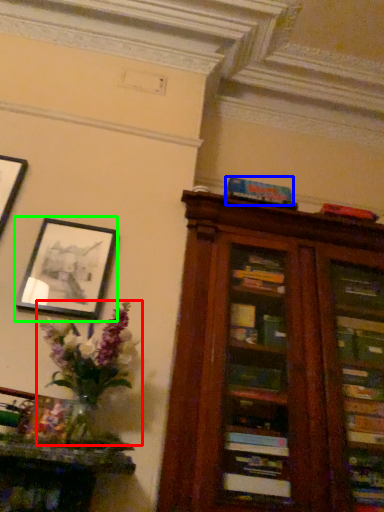
Question: Based on their relative distances, which object is farther from floral arrangement (highlighted by a red box)? Choose from paperback book (highlighted by a blue box) and picture frame (highlighted by a green box).

Choices:
 (A) paperback book
 (B) picture frame

Answer: (A)